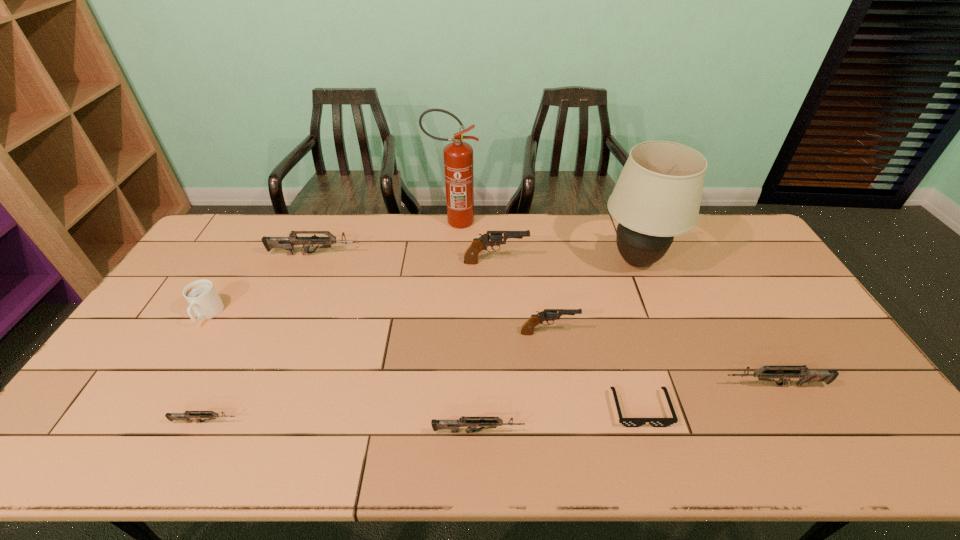
This screenshot has height=540, width=960. I want to click on free space located 0.380m on the left of the lampshade, so click(485, 261).

Image resolution: width=960 pixels, height=540 pixels. I want to click on free location located along the barrel of the eighth shortest object, so click(x=560, y=262).

At what (x,y) coordinates should I click in order to perform the action: click on vacant area located along the barrel of the nearer black gun. Please return your answer as a coordinate pair (x, y). The image size is (960, 540). Looking at the image, I should click on (609, 333).

This screenshot has height=540, width=960. Find the location of `vacant space located 0.050m aimed along the barrel of the farthest grey gun`. vacant space located 0.050m aimed along the barrel of the farthest grey gun is located at coordinates (376, 254).

This screenshot has height=540, width=960. What are the coordinates of `free space located on the side with the handle of the leftmost object` in the screenshot? It's located at (183, 355).

Locate an element on the screen. vacant space located 0.300m aimed along the barrel of the third nearest gun is located at coordinates (606, 386).

At what (x,y) coordinates should I click in order to perform the action: click on free space located aimed along the barrel of the third nearest gun. Please return your answer as a coordinate pair (x, y). Looking at the image, I should click on (566, 386).

The height and width of the screenshot is (540, 960). I want to click on vacant space located 0.080m aimed along the barrel of the third nearest gun, so click(690, 386).

You are a GUI agent. You are given a task and a screenshot of the screen. Output one action in this format:
    pyautogui.click(x=<x>, y=<y>)
    Task: Click on the vacant space located aimed along the barrel of the second smallest grey gun
    The image size is (960, 540).
    Given the screenshot: What is the action you would take?
    pyautogui.click(x=641, y=432)

The image size is (960, 540). Identify the location of free region located aimed along the barrel of the smallest grey gun. (376, 422).